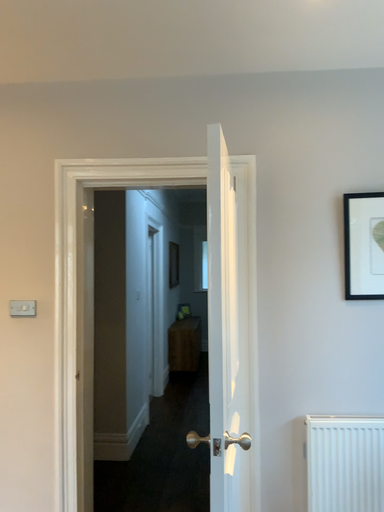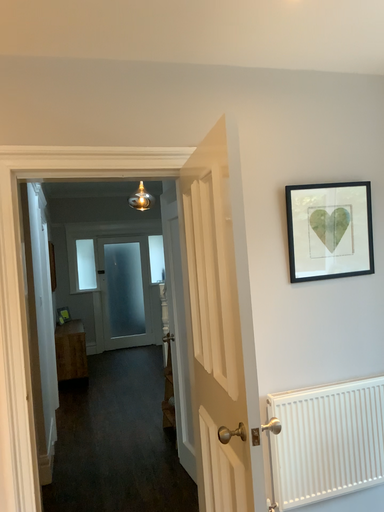
Question: Which way did the camera rotate in the video?

Choices:
 (A) rotated left
 (B) rotated right

Answer: (B)